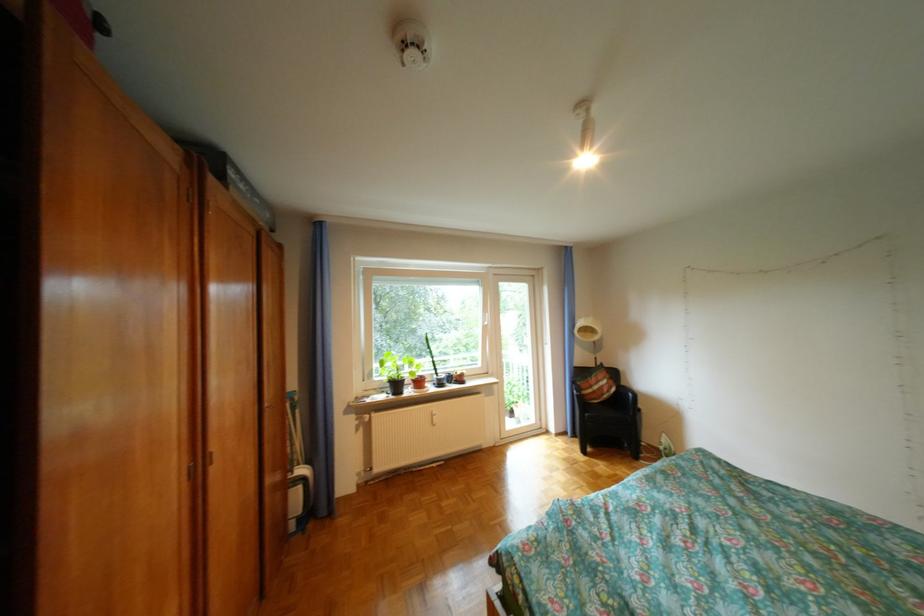
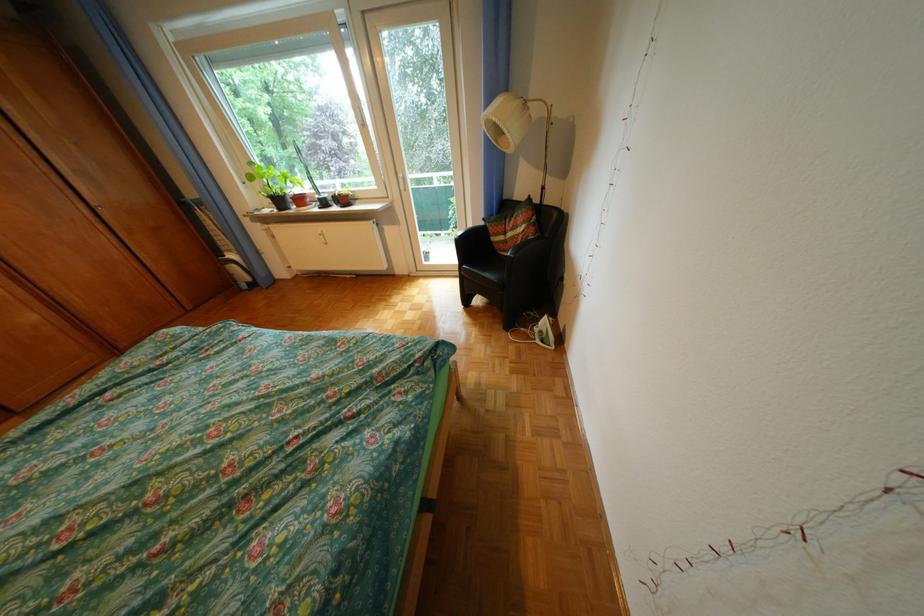
Find the pixel in the second image that matches (x=610, y=389) in the first image.

(524, 236)